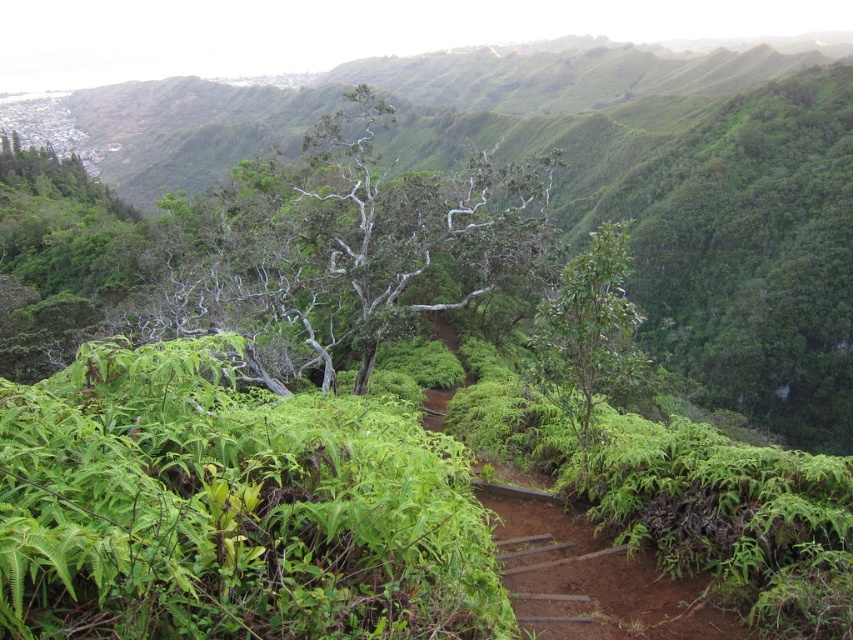
Question: Where is silver bark tree at center located in relation to green glossy tree at center in the image?

Choices:
 (A) above
 (B) below

Answer: (A)

Question: Is the position of silver bark tree at center less distant than that of green glossy tree at center?

Choices:
 (A) yes
 (B) no

Answer: (B)

Question: Which point is farther to the camera?

Choices:
 (A) (573, 400)
 (B) (305, 216)

Answer: (B)

Question: Observing the image, what is the correct spatial positioning of silver bark tree at center in reference to green glossy tree at center?

Choices:
 (A) left
 (B) right

Answer: (A)